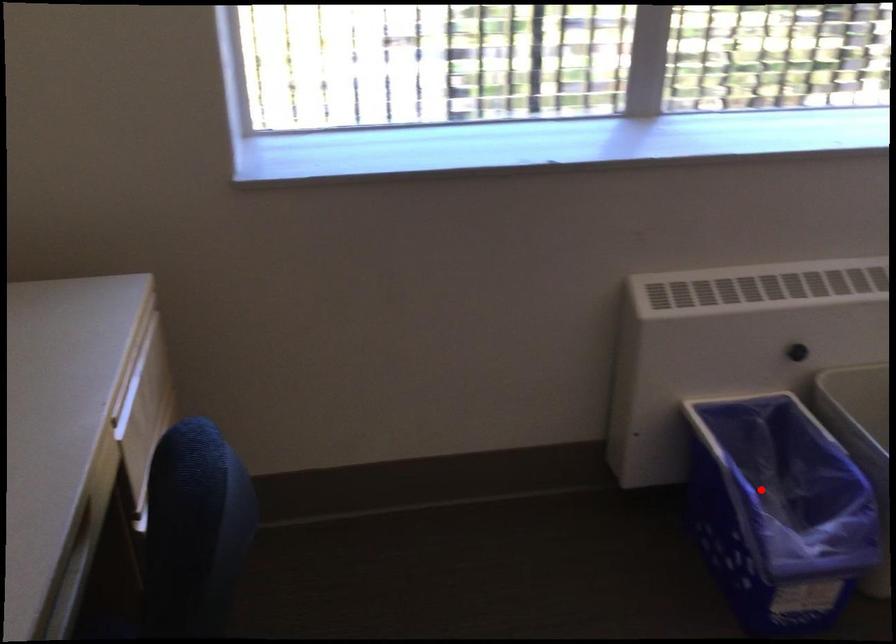
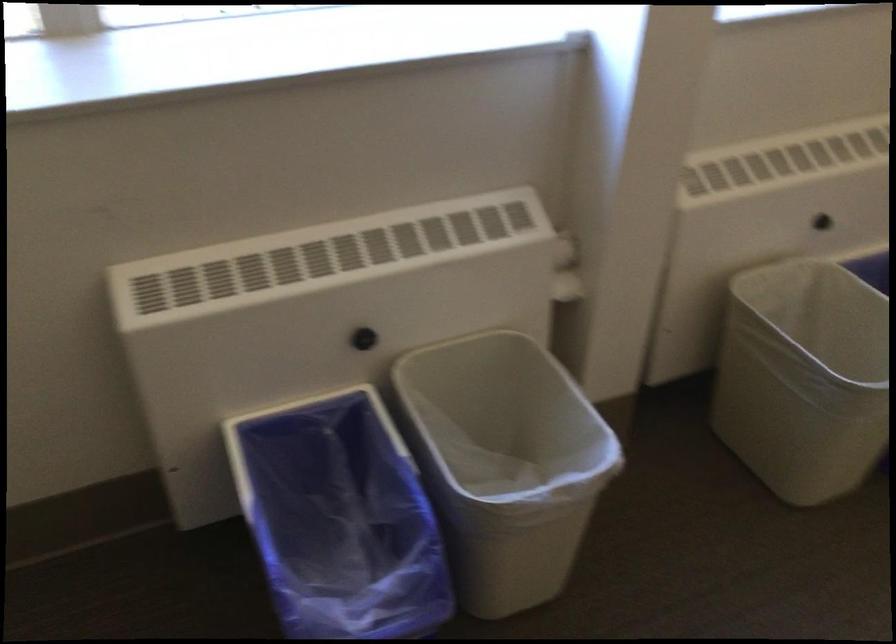
Find the pixel in the second image that matches the highlighted location in the first image.

(339, 518)